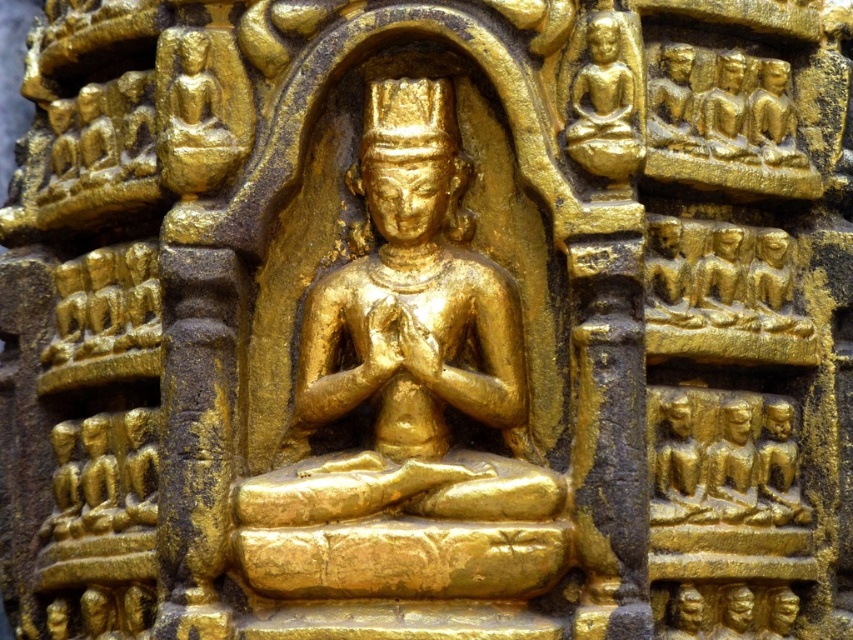
You are looking at the golden relief sculpture. There are two points marked on it, point (219,104) and point (601,92). Which point is closer to your eyes?

Point (219,104) is further to the camera than point (601,92), so the point closer to your eyes is point (601,92).

Based on the scene description, which gold polished statue is taller? The gold polished statue at center or the gold polished statue at upper right?

The gold polished statue at center is taller than the gold polished statue at upper right according to the description.